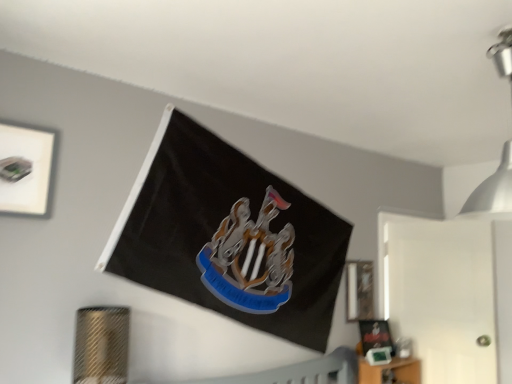
Question: Is matte black picture frame at right, the 2th picture frame ordered from the bottom, not within metallic silver light fixture at upper right?

Choices:
 (A) no
 (B) yes

Answer: (B)

Question: From the image's perspective, would you say matte black picture frame at right, positioned as the first picture frame in back-to-front order, is shown under metallic silver light fixture at upper right?

Choices:
 (A) yes
 (B) no

Answer: (A)

Question: Considering the relative sizes of matte black picture frame at right, the 2th picture frame ordered from the bottom, and metallic silver light fixture at upper right in the image provided, is matte black picture frame at right, the 2th picture frame ordered from the bottom, wider than metallic silver light fixture at upper right?

Choices:
 (A) no
 (B) yes

Answer: (A)

Question: Is matte black picture frame at right, acting as the 2th picture frame starting from the left, turned away from metallic silver light fixture at upper right?

Choices:
 (A) no
 (B) yes

Answer: (A)

Question: Is matte black picture frame at right, positioned as the first picture frame in back-to-front order, placed right next to metallic silver light fixture at upper right?

Choices:
 (A) no
 (B) yes

Answer: (A)

Question: Visually, is white matte picture frame at upper left, the first picture frame when ordered from left to right, positioned to the left or to the right of matte black picture frame at lower right, which is the 2th picture frame from front to back?

Choices:
 (A) right
 (B) left

Answer: (B)

Question: In terms of width, does white matte picture frame at upper left, the first picture frame when ordered from left to right, look wider or thinner when compared to matte black picture frame at lower right, the third picture frame from the top?

Choices:
 (A) thin
 (B) wide

Answer: (A)

Question: Would you say white matte picture frame at upper left, arranged as the first picture frame when viewed from the top, is inside or outside matte black picture frame at lower right, which is the 1th picture frame in right-to-left order?

Choices:
 (A) inside
 (B) outside

Answer: (B)

Question: From the image's perspective, is white matte picture frame at upper left, which is the first picture frame from front to back, located above or below matte black picture frame at lower right, which appears as the third picture frame when viewed from the left?

Choices:
 (A) above
 (B) below

Answer: (A)

Question: In the image, is metallic silver light fixture at upper right on the left side or the right side of matte black picture frame at lower right, the second picture frame from the back?

Choices:
 (A) right
 (B) left

Answer: (A)

Question: Which is correct: metallic silver light fixture at upper right is inside matte black picture frame at lower right, the third picture frame from the top, or outside of it?

Choices:
 (A) outside
 (B) inside

Answer: (A)

Question: In terms of size, does metallic silver light fixture at upper right appear bigger or smaller than matte black picture frame at lower right, the third picture frame from the top?

Choices:
 (A) big
 (B) small

Answer: (A)

Question: Is metallic silver light fixture at upper right taller or shorter than matte black picture frame at lower right, which is the 2th picture frame from front to back?

Choices:
 (A) tall
 (B) short

Answer: (A)

Question: Would you say matte black picture frame at right, the 2th picture frame ordered from the bottom, is to the left or to the right of matte black picture frame at lower right, the third picture frame from the top, in the picture?

Choices:
 (A) left
 (B) right

Answer: (A)

Question: Does point (367, 274) appear closer or farther from the camera than point (369, 329)?

Choices:
 (A) closer
 (B) farther

Answer: (B)